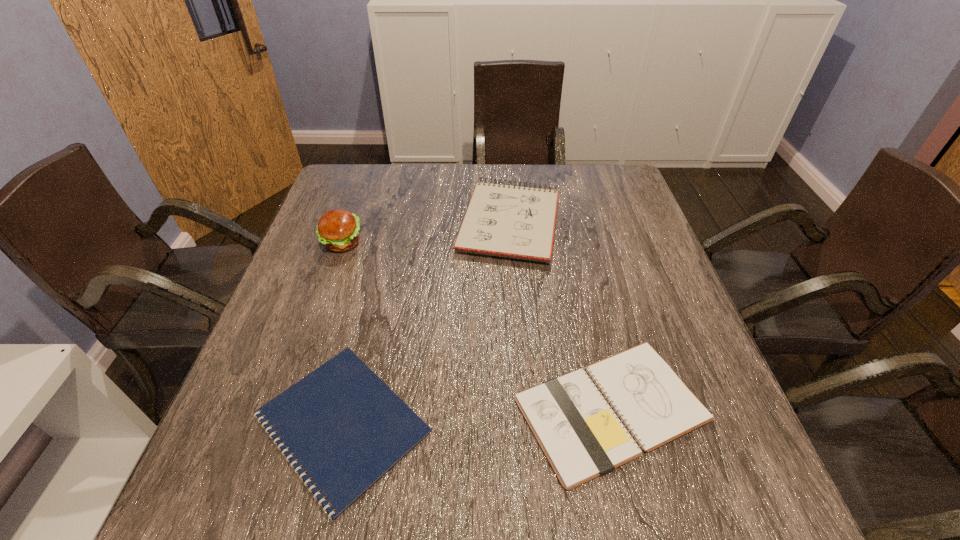
The image size is (960, 540). In order to click on free point that satisfies the following two spatial constraints: 1. on the back side of the farthest notepad; 2. on the left side of the hamburger in this screenshot , I will do `click(349, 222)`.

Where is `free space that satisfies the following two spatial constraints: 1. on the front side of the tallest notepad; 2. on the right side of the second tallest notepad`? The image size is (960, 540). free space that satisfies the following two spatial constraints: 1. on the front side of the tallest notepad; 2. on the right side of the second tallest notepad is located at coordinates (524, 409).